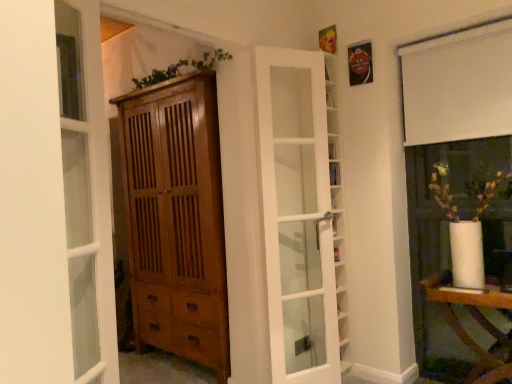
Question: Is white glossy table at lower right positioned with its back to white glass door at center?

Choices:
 (A) yes
 (B) no

Answer: (B)

Question: Is white glossy table at lower right facing towards white glass door at center?

Choices:
 (A) yes
 (B) no

Answer: (B)

Question: Is white glossy table at lower right bigger than white glass door at center?

Choices:
 (A) no
 (B) yes

Answer: (B)

Question: Is the position of white glossy table at lower right more distant than that of white glass door at center?

Choices:
 (A) yes
 (B) no

Answer: (B)

Question: From the image's perspective, is white glossy table at lower right located above white glass door at center?

Choices:
 (A) no
 (B) yes

Answer: (A)

Question: Considering the relative positions of clear glass door at left and white glossy table at lower right in the image provided, is clear glass door at left to the left or to the right of white glossy table at lower right?

Choices:
 (A) left
 (B) right

Answer: (A)

Question: From a real-world perspective, is clear glass door at left positioned above or below white glossy table at lower right?

Choices:
 (A) above
 (B) below

Answer: (A)

Question: Is clear glass door at left taller or shorter than white glossy table at lower right?

Choices:
 (A) short
 (B) tall

Answer: (B)

Question: In terms of width, does clear glass door at left look wider or thinner when compared to white glossy table at lower right?

Choices:
 (A) thin
 (B) wide

Answer: (A)

Question: From a real-world perspective, is clear glass door at left above or below wooden cabinet at center?

Choices:
 (A) above
 (B) below

Answer: (A)

Question: Does point (95, 144) appear closer or farther from the camera than point (176, 139)?

Choices:
 (A) closer
 (B) farther

Answer: (A)

Question: Considering the relative positions of clear glass door at left and wooden cabinet at center in the image provided, is clear glass door at left to the left or to the right of wooden cabinet at center?

Choices:
 (A) left
 (B) right

Answer: (A)

Question: Considering their positions, is clear glass door at left located in front of or behind wooden cabinet at center?

Choices:
 (A) behind
 (B) front

Answer: (B)

Question: Considering their positions, is white matte curtain at upper right located in front of or behind clear glass door at left?

Choices:
 (A) front
 (B) behind

Answer: (B)

Question: Considering the positions of point (501, 31) and point (88, 11), is point (501, 31) closer or farther from the camera than point (88, 11)?

Choices:
 (A) closer
 (B) farther

Answer: (B)